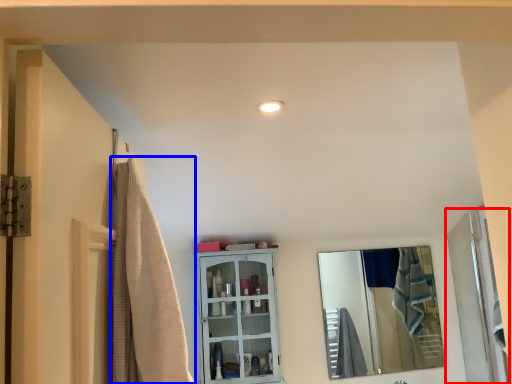
Question: Which object is further to the camera taking this photo, door (highlighted by a red box) or shower curtain (highlighted by a blue box)?

Choices:
 (A) door
 (B) shower curtain

Answer: (A)